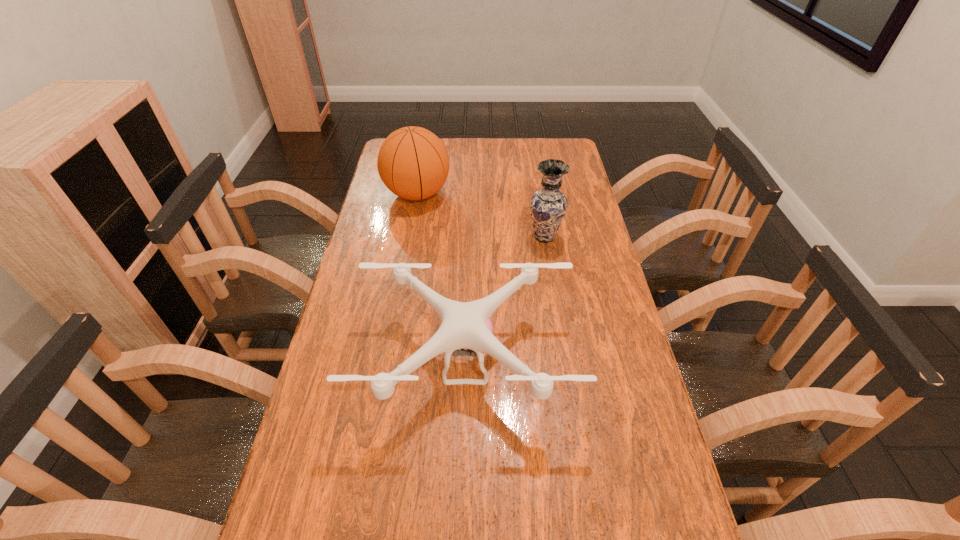
The image size is (960, 540). Find the location of `vacant point at the far edge`. vacant point at the far edge is located at coordinates (466, 148).

Locate an element on the screen. This screenshot has width=960, height=540. vacant space at the left edge of the desktop is located at coordinates (385, 289).

The height and width of the screenshot is (540, 960). In the image, there is a desktop. In order to click on vacant space at the right edge in this screenshot , I will do `click(566, 246)`.

This screenshot has width=960, height=540. Identify the location of vacant area that lies between the vase and the basketball. (481, 215).

This screenshot has width=960, height=540. Find the location of `vacant area between the basketball and the second nearest object`. vacant area between the basketball and the second nearest object is located at coordinates (481, 215).

I want to click on free area in between the second nearest object and the basketball, so click(481, 215).

The image size is (960, 540). What are the coordinates of `object that stands as the second closest to the drone` in the screenshot? It's located at (413, 163).

This screenshot has height=540, width=960. Find the location of `object that ranks as the second closest to the second farthest object`. object that ranks as the second closest to the second farthest object is located at coordinates (413, 163).